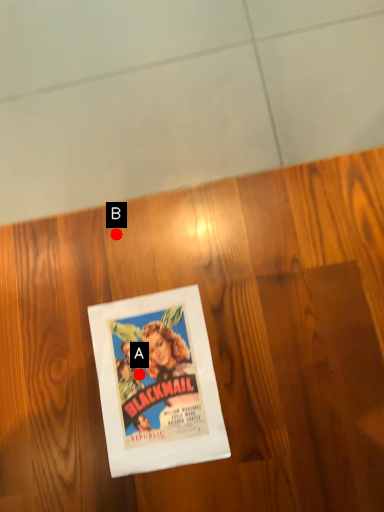
Question: Two points are circled on the image, labeled by A and B beside each circle. Among these points, which one is farthest from the camera?

Choices:
 (A) A is further
 (B) B is further

Answer: (B)